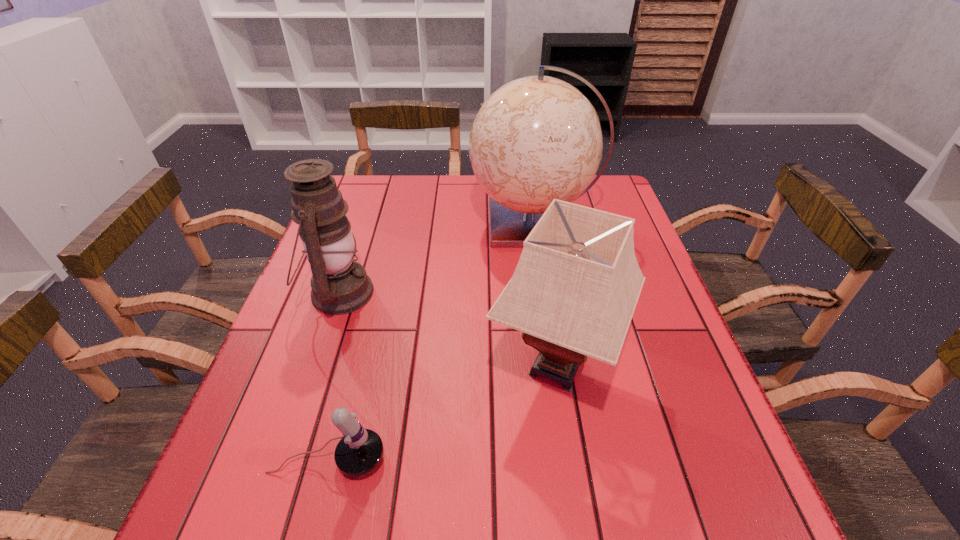
Where is `the farthest object`? The width and height of the screenshot is (960, 540). the farthest object is located at coordinates (538, 138).

Identify the location of the tallest object. This screenshot has width=960, height=540. (538, 138).

The height and width of the screenshot is (540, 960). Find the location of `oil lamp`. oil lamp is located at coordinates (339, 285).

This screenshot has width=960, height=540. I want to click on lampshade, so 573,293.

Where is `the shortest object`? This screenshot has height=540, width=960. the shortest object is located at coordinates (360, 450).

You are a GUI agent. You are given a task and a screenshot of the screen. Output one action in this format:
    pyautogui.click(x=<x>, y=<y>)
    Task: Click on the nearest object
    
    Given the screenshot: What is the action you would take?
    pyautogui.click(x=360, y=450)

The image size is (960, 540). In order to click on free space located 0.370m on the surface of the globe showing Europe and Africa in this screenshot , I will do `click(344, 224)`.

This screenshot has height=540, width=960. I want to click on free space located 0.230m on the surface of the globe showing Europe and Africa, so click(392, 224).

At what (x,y) coordinates should I click in order to perform the action: click on free region located 0.260m on the surface of the globe showing Europe and Africa. Please return your answer as a coordinate pair (x, y). Looking at the image, I should click on (381, 224).

Identify the location of free space located 0.170m on the back of the oil lamp. (362, 226).